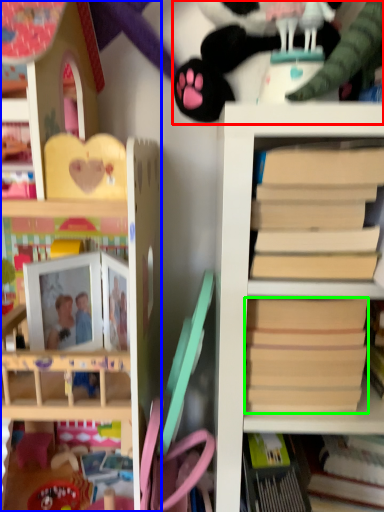
Question: Which object is positioned closest to toy (highlighted by a red box)? Select from shelf (highlighted by a blue box) and paperback book (highlighted by a green box).

Choices:
 (A) shelf
 (B) paperback book

Answer: (A)